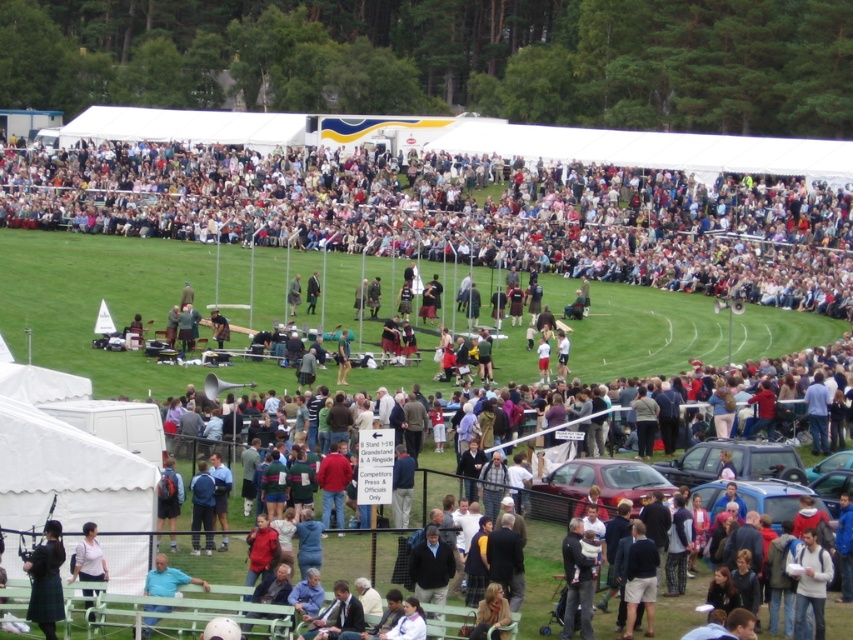
Is the position of light brown fabric crowd at upper center less distant than that of white matte shirt at lower left?

No, light brown fabric crowd at upper center is further to the viewer.

Image resolution: width=853 pixels, height=640 pixels. What do you see at coordinates (457, 212) in the screenshot? I see `light brown fabric crowd at upper center` at bounding box center [457, 212].

This screenshot has height=640, width=853. I want to click on light brown fabric crowd at upper center, so click(x=457, y=212).

Who is higher up, matte red car at center or dark brown kilt at lower left?

matte red car at center is above.

Consider the image. Does matte red car at center come behind dark brown kilt at lower left?

Yes, matte red car at center is behind dark brown kilt at lower left.

Is point (619, 486) behind point (53, 577)?

That is True.

Locate an element on the screen. Image resolution: width=853 pixels, height=640 pixels. matte red car at center is located at coordinates (596, 484).

Does light brown fabric crowd at upper center have a smaller size compared to matte black car at center?

No, light brown fabric crowd at upper center is not smaller than matte black car at center.

Is point (271, 218) positioned in front of point (790, 451)?

No.

Locate an element on the screen. The height and width of the screenshot is (640, 853). light brown fabric crowd at upper center is located at coordinates (457, 212).